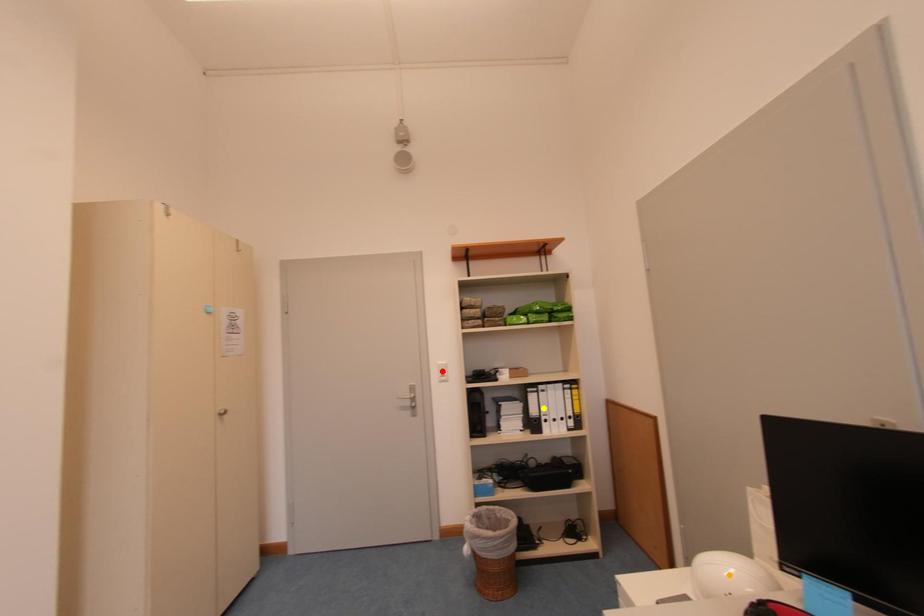
Order these from farthest to nearest:
orange point | red point | yellow point

red point
yellow point
orange point